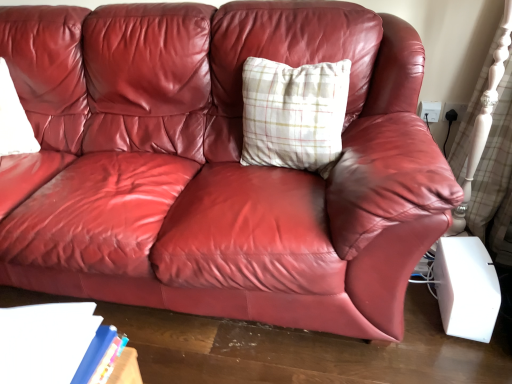
Question: Choose the correct answer: Is white plaid pillow at center inside blue hardcover book at lower left or outside it?

Choices:
 (A) outside
 (B) inside

Answer: (A)

Question: Considering the relative positions of white plaid pillow at center and blue hardcover book at lower left in the image provided, is white plaid pillow at center to the left or to the right of blue hardcover book at lower left?

Choices:
 (A) right
 (B) left

Answer: (A)

Question: From a real-world perspective, is white plaid pillow at center above or below blue hardcover book at lower left?

Choices:
 (A) above
 (B) below

Answer: (A)

Question: Visually, is blue hardcover book at lower left positioned to the left or to the right of white plaid pillow at center?

Choices:
 (A) left
 (B) right

Answer: (A)

Question: From a real-world perspective, is blue hardcover book at lower left above or below white plaid pillow at center?

Choices:
 (A) below
 (B) above

Answer: (A)

Question: Is blue hardcover book at lower left situated inside white plaid pillow at center or outside?

Choices:
 (A) outside
 (B) inside

Answer: (A)

Question: Is blue hardcover book at lower left in front of or behind white plaid pillow at center in the image?

Choices:
 (A) behind
 (B) front

Answer: (B)